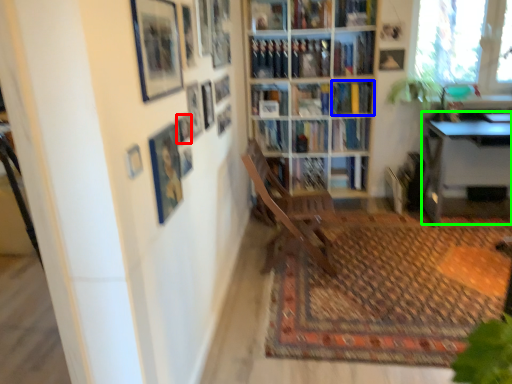
Question: Based on their relative distances, which object is nearer to picture frame (highlighted by a red box)? Choose from book (highlighted by a blue box) and table (highlighted by a green box).

Choices:
 (A) book
 (B) table

Answer: (A)